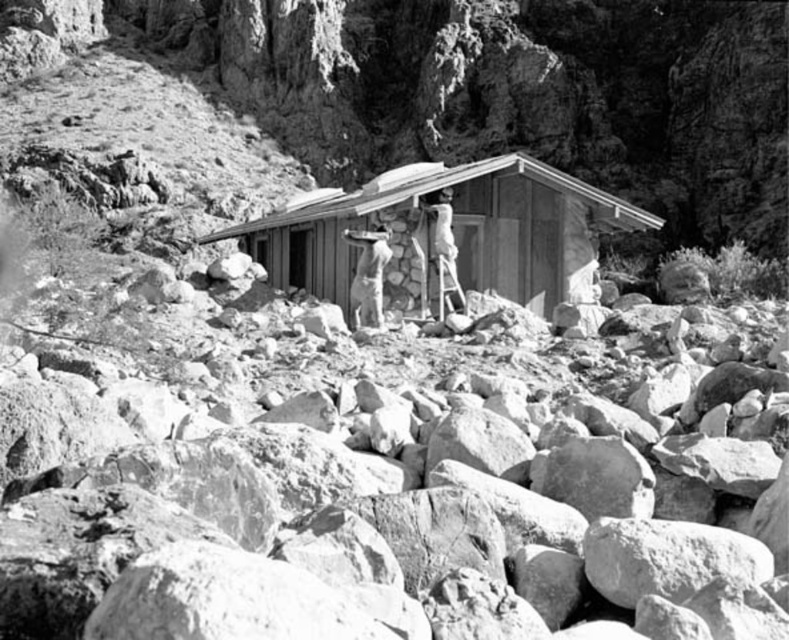
Who is shorter, wooden cabin at center or smooth wooden ladder at center?

Standing shorter between the two is smooth wooden ladder at center.

Between wooden cabin at center and smooth wooden ladder at center, which one appears on the left side from the viewer's perspective?

wooden cabin at center

The height and width of the screenshot is (640, 789). In order to click on wooden cabin at center in this screenshot , I will do `click(454, 225)`.

Measure the distance between point [451,304] and camera.

Point [451,304] is 59.40 meters away from camera.

Does smooth wooden ladder at center have a greater width compared to smooth beige uniform at center?

No, smooth wooden ladder at center is not wider than smooth beige uniform at center.

Does point (451, 243) come closer to viewer compared to point (380, 230)?

Yes, point (451, 243) is in front of point (380, 230).

Where is `smooth wooden ladder at center`? smooth wooden ladder at center is located at coordinates (439, 248).

Consider the image. Is wooden cabin at center below smooth beige uniform at center?

No, wooden cabin at center is not below smooth beige uniform at center.

Which is below, wooden cabin at center or smooth beige uniform at center?

smooth beige uniform at center is lower down.

Identify the location of wooden cabin at center. This screenshot has height=640, width=789. (454, 225).